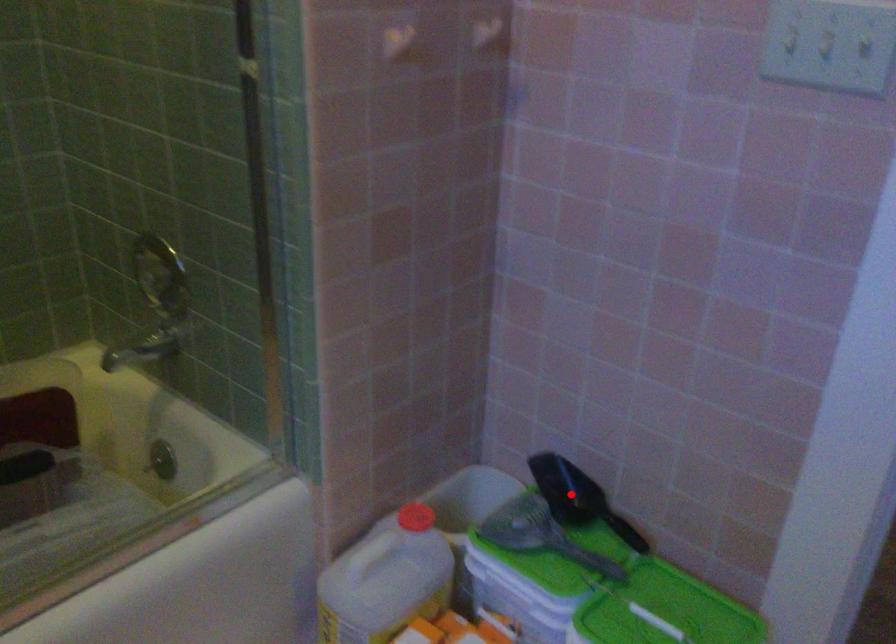
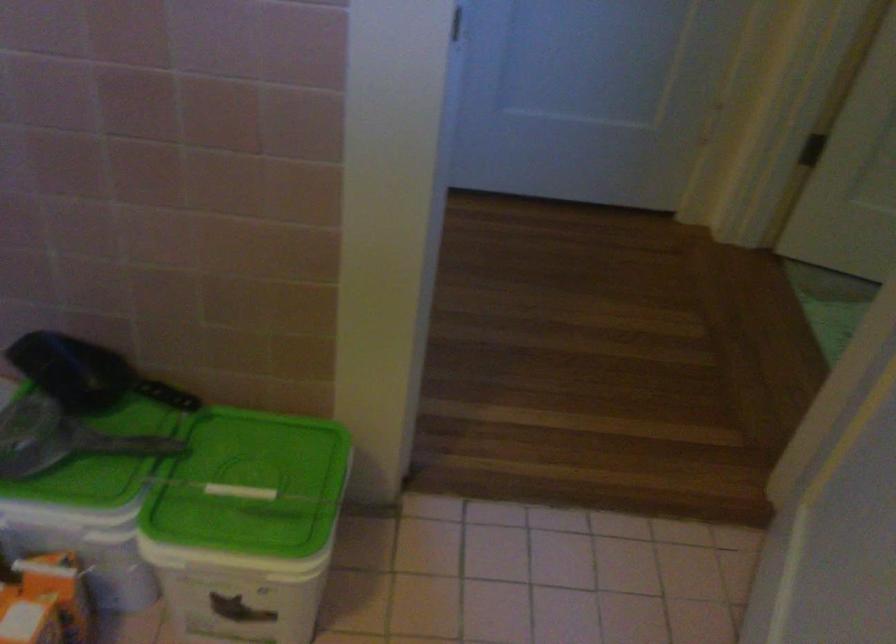
Locate, in the second image, the point that corresponds to the highlighted location in the first image.

(85, 374)